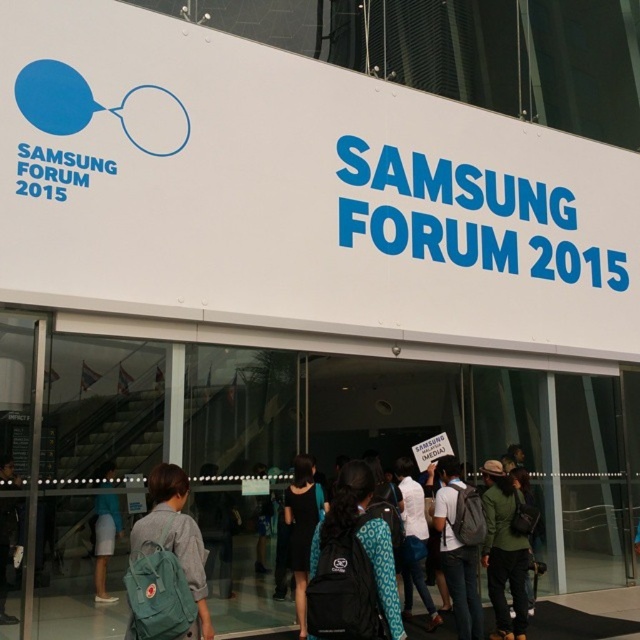
Question: Can you confirm if teal fabric backpack at center is positioned below blue denim shorts at lower left?

Choices:
 (A) yes
 (B) no

Answer: (B)

Question: Is matte black backpack at center thinner than green matte jacket at center?

Choices:
 (A) no
 (B) yes

Answer: (B)

Question: Does teal fabric backpack at center have a lesser width compared to light blue backpack at lower left?

Choices:
 (A) yes
 (B) no

Answer: (B)

Question: Among these objects, which one is farthest from the camera?

Choices:
 (A) teal backpack at center
 (B) green matte jacket at center
 (C) light blue backpack at lower left
 (D) white cotton shirt at center

Answer: (D)

Question: Considering the real-world distances, which object is closest to the blue denim shorts at lower left?

Choices:
 (A) teal backpack at center
 (B) matte black backpack at center

Answer: (A)

Question: Among these points, which one is farthest from the camera?

Choices:
 (A) (465, 624)
 (B) (300, 490)

Answer: (B)